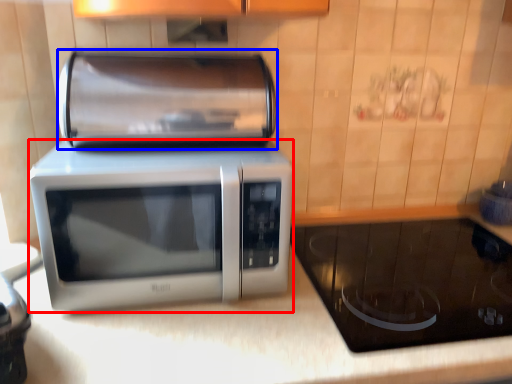
Question: Which of the following is the farthest to the observer, microwave oven (highlighted by a red box) or appliance (highlighted by a blue box)?

Choices:
 (A) microwave oven
 (B) appliance

Answer: (B)